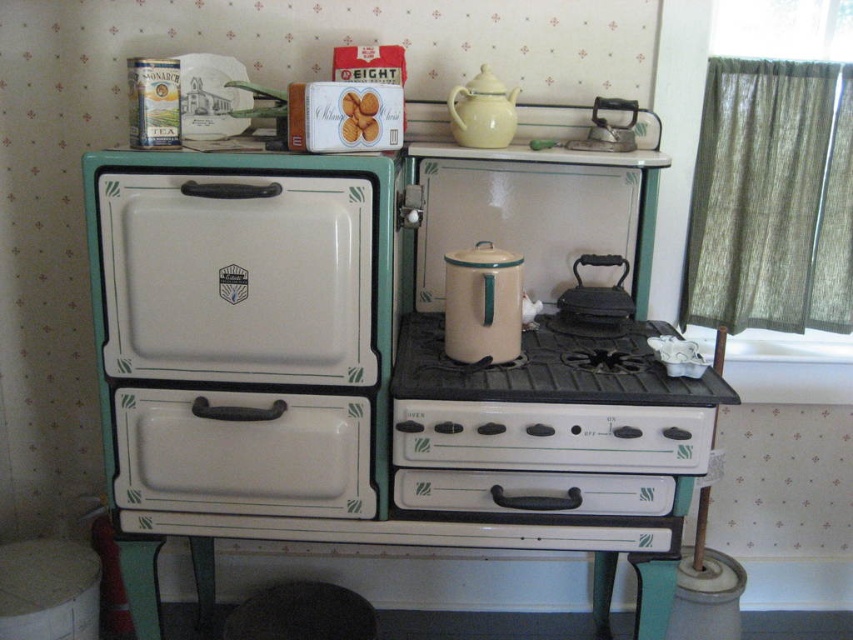
Is white enamel gas stove at center to the left of beige enamel canister at center from the viewer's perspective?

In fact, white enamel gas stove at center is to the right of beige enamel canister at center.

Is white enamel gas stove at center positioned behind beige enamel canister at center?

No, it is not.

Describe the element at coordinates (550, 403) in the screenshot. Image resolution: width=853 pixels, height=640 pixels. I see `white enamel gas stove at center` at that location.

Where is `white enamel gas stove at center`? The image size is (853, 640). white enamel gas stove at center is located at coordinates (550, 403).

Which is more to the right, white enamel gas stove at center or black cast iron griddle at center?

black cast iron griddle at center is more to the right.

This screenshot has height=640, width=853. I want to click on white enamel gas stove at center, so click(550, 403).

Does white enameled cabinet at center appear on the right side of black rubber stool at lower center?

Indeed, white enameled cabinet at center is positioned on the right side of black rubber stool at lower center.

This screenshot has width=853, height=640. Describe the element at coordinates (242, 330) in the screenshot. I see `white enameled cabinet at center` at that location.

Where is `white enameled cabinet at center`? This screenshot has width=853, height=640. white enameled cabinet at center is located at coordinates click(x=242, y=330).